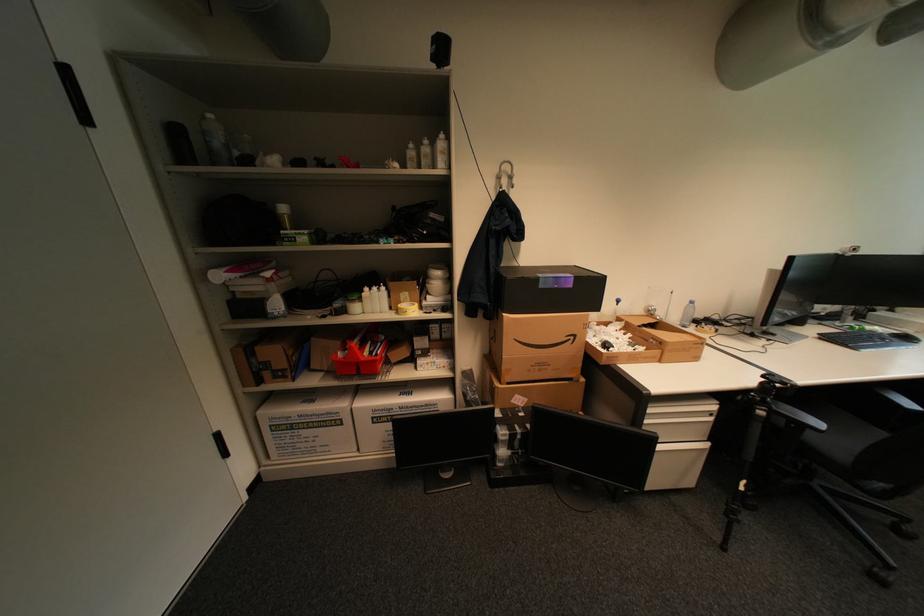
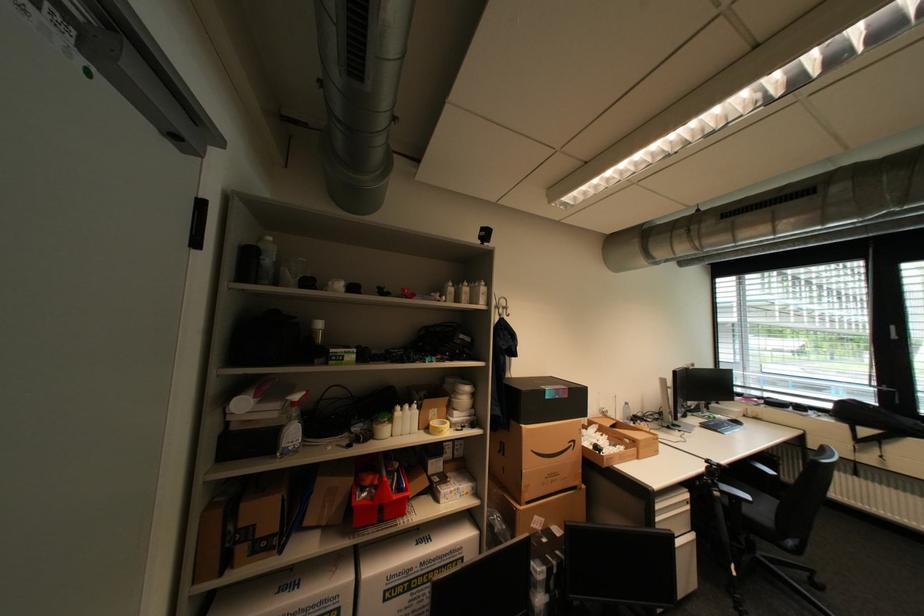
How did the camera likely rotate?

The rotation direction of the camera is right-up.